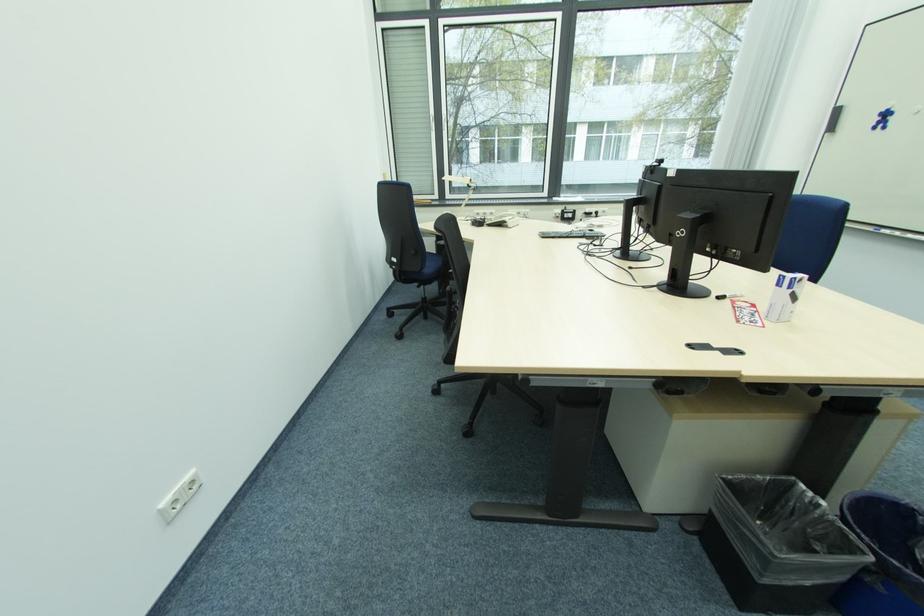
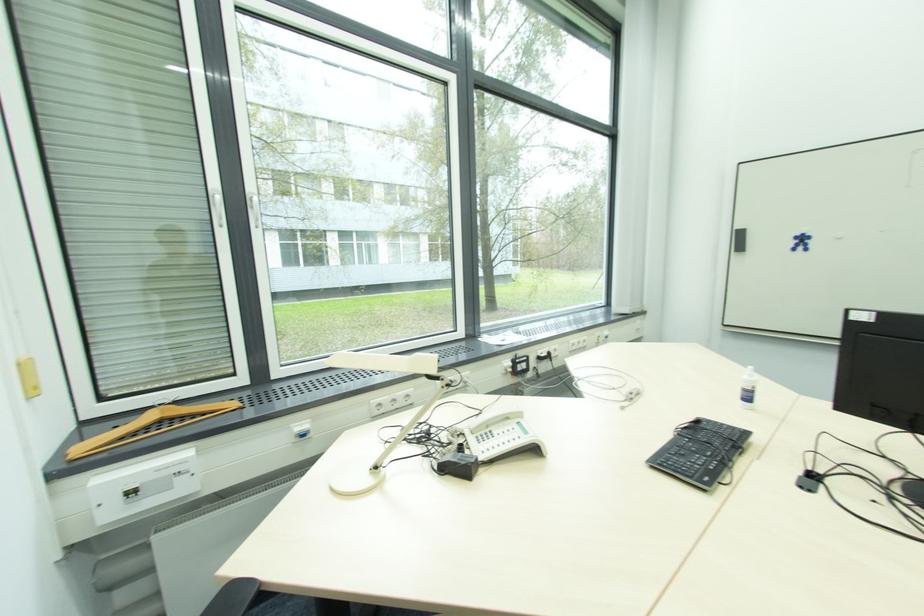
The point at (594, 233) is marked in the first image. Where is the corresponding point in the second image?

(700, 424)